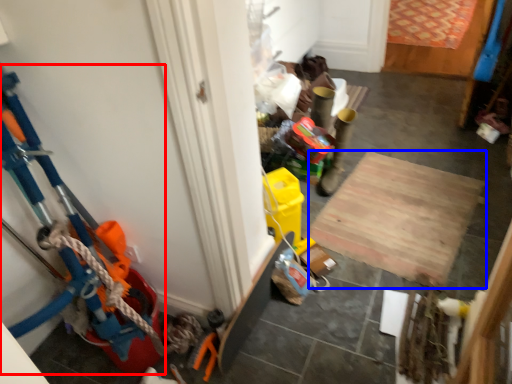
Question: Which point is closer to the camera, toy (highlighted by a red box) or plywood (highlighted by a blue box)?

Choices:
 (A) toy
 (B) plywood

Answer: (A)